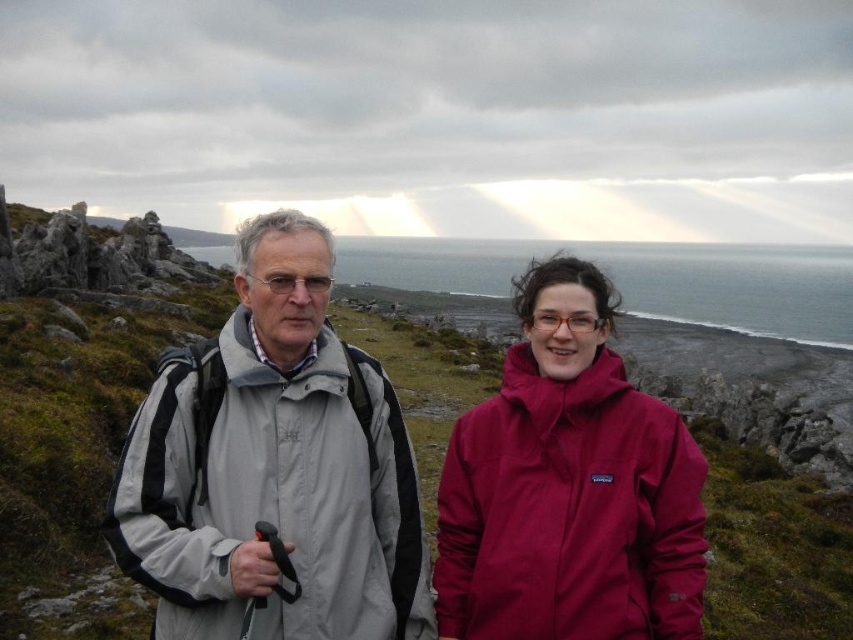
You are planning to take a photo of both the gray fabric jacket at center and the burgundy waterproof jacket at center. Since you want both jackets to be clearly visible in the photo, which jacket should you focus on to ensure the other is also in focus?

You should focus on the gray fabric jacket at center because it is closer to the viewer than the burgundy waterproof jacket at center, so focusing on the closer one will help keep both in focus.

You are a hiker planning to cross a stream. You see the burgundy waterproof jacket at center and the gray water at center in the scene. Which object is shorter in height?

The burgundy waterproof jacket at center has a lesser height compared to the gray water at center, so the jacket is shorter in height.

You are a hiker who wants to know if the gray fabric jacket at center is currently above or below the gray water at center in the scene. Based on the image, which is true?

The gray fabric jacket at center is positioned under gray water at center, so it is below the water.